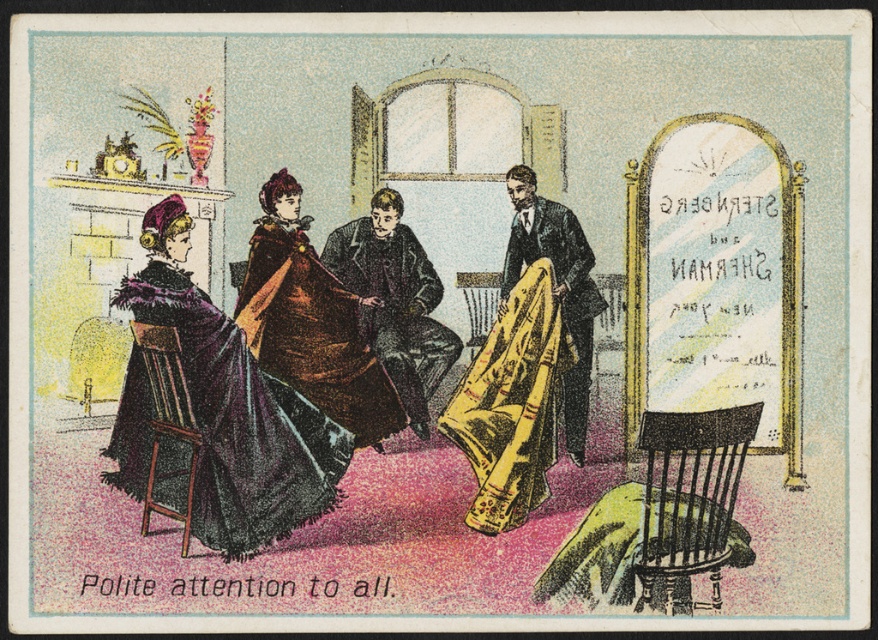
You are a guest at a formal gathering in this room. You notice the yellow satin dress at center and the velvet brown coat at center. Which one is closer to the fireplace on the left side?

The yellow satin dress at center is positioned under the velvet brown coat at center, meaning it is closer to the fireplace on the left side.

In the vintage scene, there are two people wearing a yellow satin dress at center and a velvet brown coat at center. Which one is positioned to the right of the other?

The yellow satin dress at center is to the right of the velvet brown coat at center.

Looking at this image, in the vintage room scene, there is a velvet brown coat at center and a wooden chair at center. Which object is taller?

The velvet brown coat at center is much taller than the wooden chair at center.